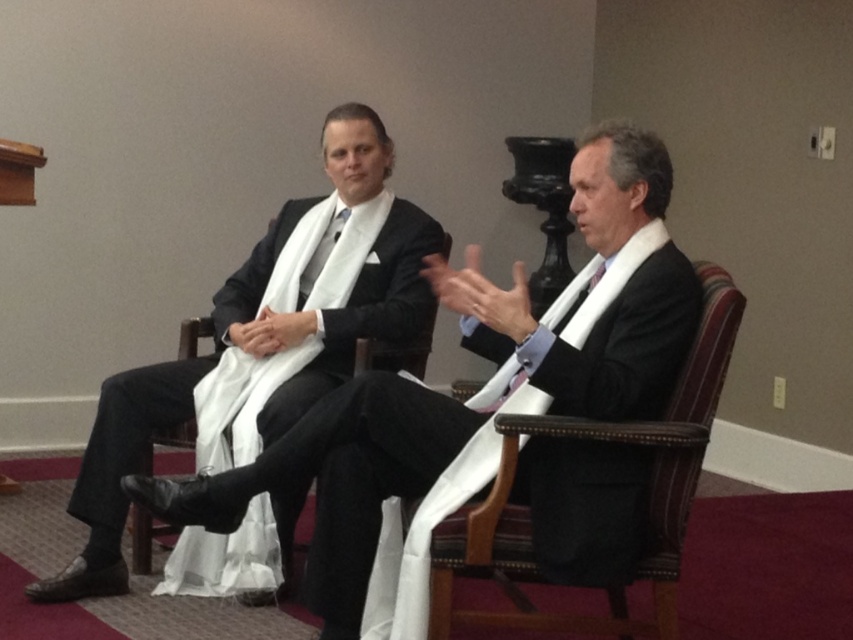
You are a photographer trying to capture a closeup of the purple satin tie at center without including the brown leather chair at right in the frame. Is it possible to do so based on their positions?

The brown leather chair at right might be wider than purple satin tie at center, so it depends on their exact positions. If the chair is wider, it might block the view of the tie unless you adjust your angle or move closer.

Based on the scene description, can you determine if the matte black suit at center is positioned higher than the brown leather chair at right?

The matte black suit at center is located above the brown leather chair at right, so yes, it is positioned higher.

Based on the scene description, which object is wider, the matte black suit at center or the brown leather chair at right?

The matte black suit at center is wider than the brown leather chair at right according to the description.